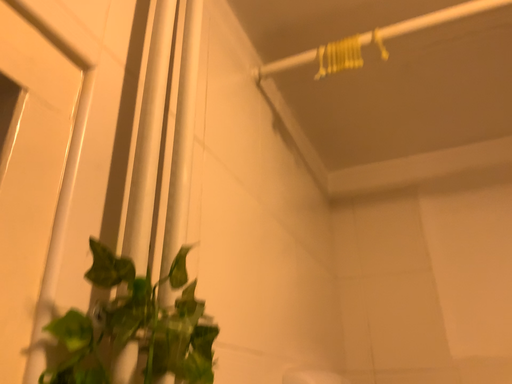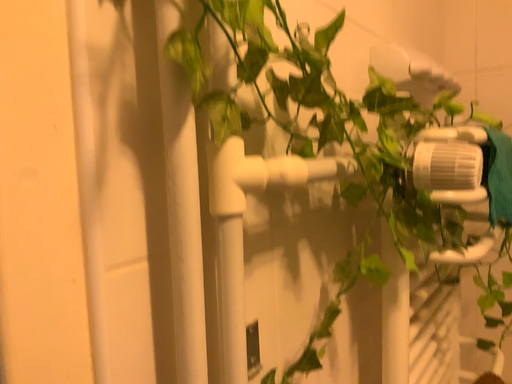
Question: How did the camera likely rotate when shooting the video?

Choices:
 (A) rotated left
 (B) rotated right

Answer: (A)